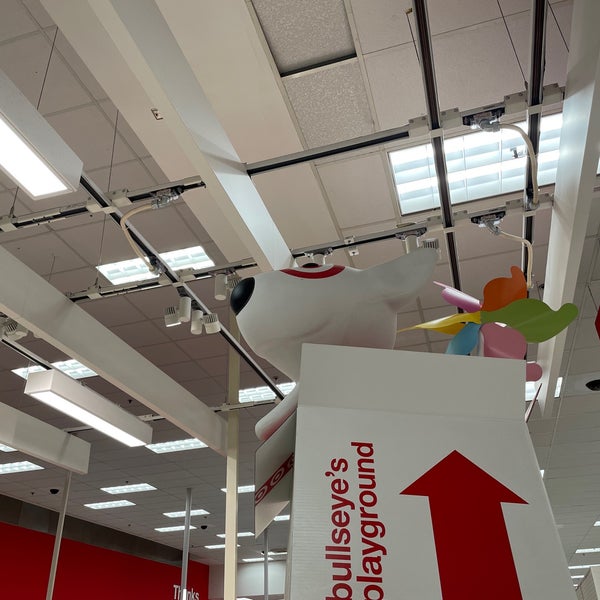
In order to click on lighting on track in this screenshot , I will do `click(89, 414)`, `click(41, 180)`.